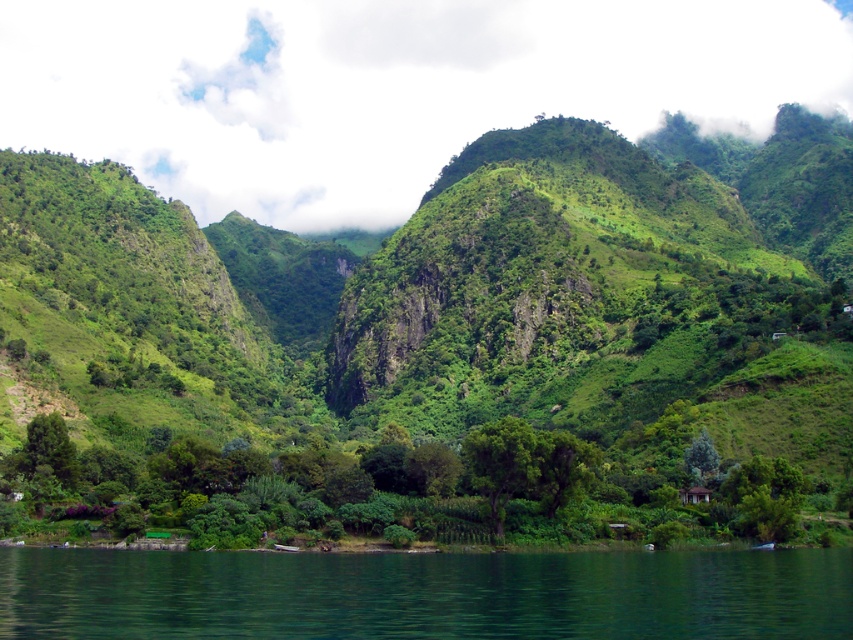
You are an environmental scientist analyzing the landscape. You observe the green leafy mountain at center and the green leafy trees at center. Which of these two has a greater height?

The green leafy mountain at center is much taller than the green leafy trees at center.

You are a drone operator planning to fly a drone from the white fluffy cloud at upper center to the green liquid water at lower center. According to the scene description, what is the minimum distance you need to cover in meters?

The white fluffy cloud at upper center is 511.53 meters away from the green liquid water at lower center, so the minimum distance you need to cover is 511.53 meters.

You are an airplane passenger looking out the window. You see the white fluffy cloud at upper center and the green leafy trees at center. Which object is closer to the airplane?

The white fluffy cloud at upper center is closer to the airplane because it is further to the viewer than the green leafy trees at center, meaning it appears nearer in the visual perspective.